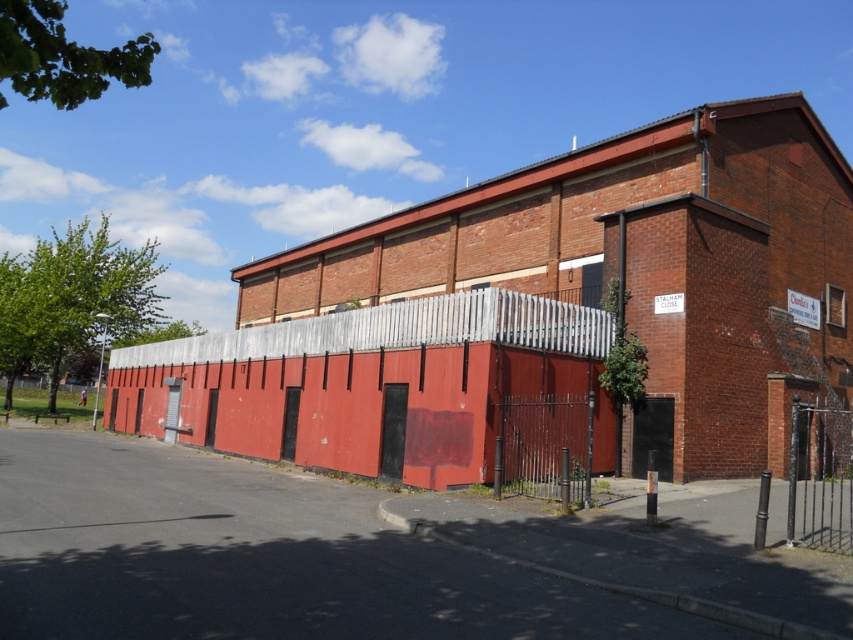
Does brick building at center have a smaller size compared to black wrought iron gate at center?

No, brick building at center is not smaller than black wrought iron gate at center.

Does brick building at center have a lesser width compared to black wrought iron gate at center?

No.

Does point (698, 353) lie behind point (592, 426)?

That is True.

Image resolution: width=853 pixels, height=640 pixels. In order to click on brick building at center in this screenshot , I will do `click(636, 260)`.

Can you confirm if brick building at center is smaller than smooth red fence at center?

No, brick building at center is not smaller than smooth red fence at center.

Who is more forward, [665,396] or [527,308]?

Point [527,308]

Which is behind, point (587, 253) or point (608, 333)?

Point (587, 253)

Find the location of a particular element. The height and width of the screenshot is (640, 853). brick building at center is located at coordinates (636, 260).

Is smooth red fence at center to the left of black wrought iron fence at right from the viewer's perspective?

Indeed, smooth red fence at center is positioned on the left side of black wrought iron fence at right.

Which is behind, point (489, 308) or point (813, 499)?

Point (489, 308)

Identify the location of smooth red fence at center. (367, 381).